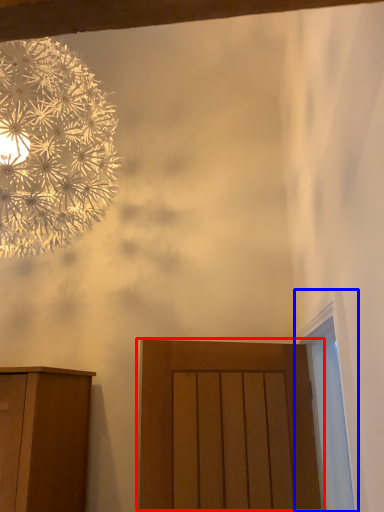
Question: Which point is further to the camera, door (highlighted by a red box) or window (highlighted by a blue box)?

Choices:
 (A) door
 (B) window

Answer: (A)